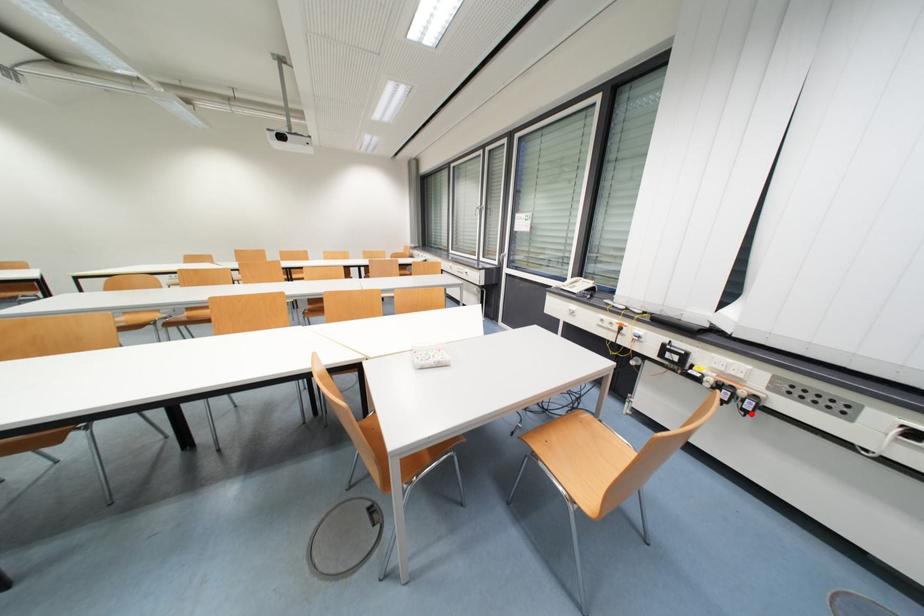
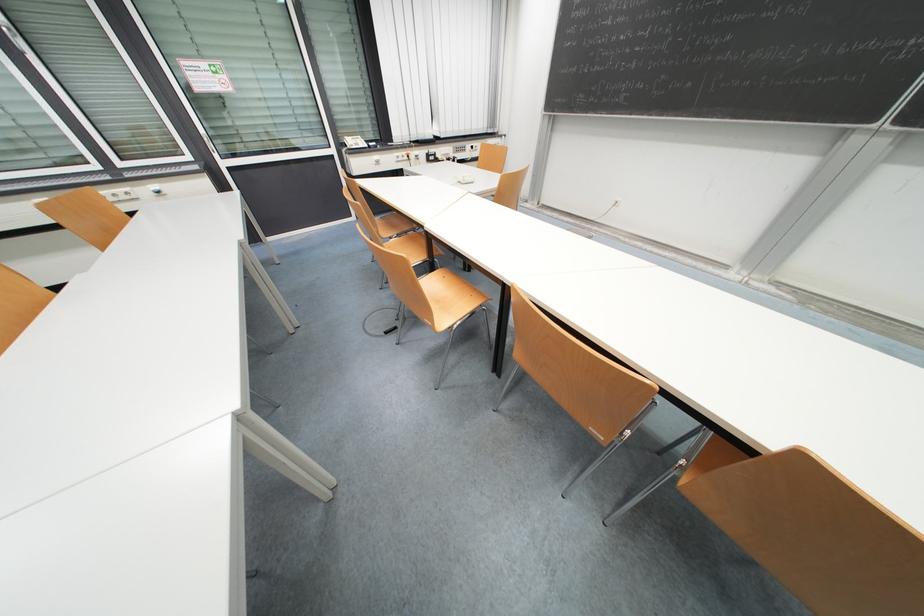
Question: I am providing you with two images of the same scene from different viewpoints. A red point is marked on the first image. At the location where the point appears in image 1, is it still visible in image 2?

Choices:
 (A) Yes
 (B) No

Answer: (B)